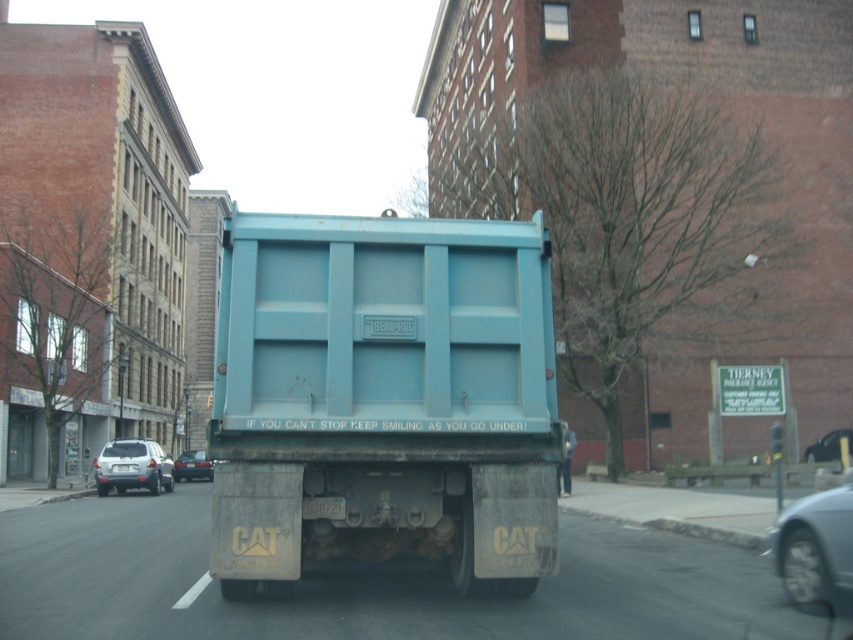
Does shiny black car at center come in front of white plastic license plate at center?

No, it is not.

Between point (824, 435) and point (132, 467), which one is positioned behind?

Point (824, 435)

Where is `shiny black car at center`? This screenshot has height=640, width=853. shiny black car at center is located at coordinates (828, 445).

Between blue matte dump truck at center and shiny black car at center, which one appears on the left side from the viewer's perspective?

From the viewer's perspective, blue matte dump truck at center appears more on the left side.

Is blue matte dump truck at center thinner than shiny black car at center?

Incorrect, blue matte dump truck at center's width is not less than shiny black car at center's.

Who is more distant from viewer, (397, 358) or (811, 451)?

Point (811, 451)

The height and width of the screenshot is (640, 853). Find the location of `blue matte dump truck at center`. blue matte dump truck at center is located at coordinates (383, 397).

Can you confirm if blue matte dump truck at center is positioned to the right of metallic silver car at lower right?

Incorrect, blue matte dump truck at center is not on the right side of metallic silver car at lower right.

Can you confirm if blue matte dump truck at center is positioned to the left of metallic silver car at lower right?

Indeed, blue matte dump truck at center is positioned on the left side of metallic silver car at lower right.

Does point (554, 525) lie in front of point (808, 550)?

No, it is behind (808, 550).

At what (x,y) coordinates should I click in order to perform the action: click on blue matte dump truck at center. Please return your answer as a coordinate pair (x, y). The width and height of the screenshot is (853, 640). Looking at the image, I should click on (383, 397).